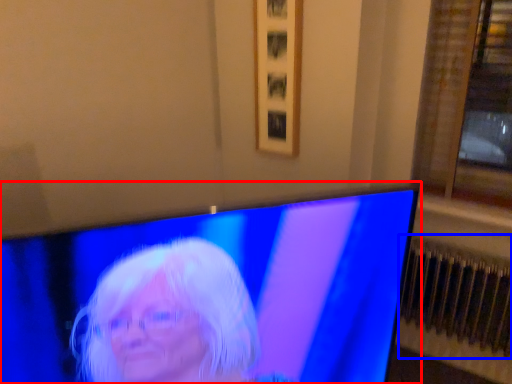
Question: Among these objects, which one is nearest to the camera, television (highlighted by a red box) or radiator (highlighted by a blue box)?

Choices:
 (A) television
 (B) radiator

Answer: (A)